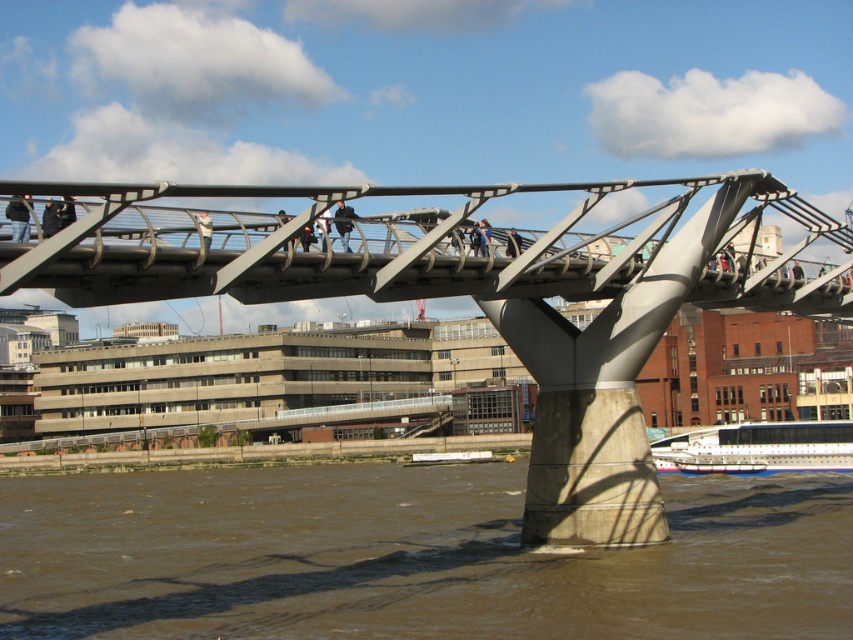
You are standing on the Millennium Bridge and notice the brown muddy water at lower center and the black matte pedestrian at center. From your perspective, which object is closer to you?

The brown muddy water at lower center is closer to you because it is in front of the black matte pedestrian at center.

You are standing on the polished steel bridge at center and want to take a photo of the dark blue jeans at left. Which direction should you face to capture both the bridge and the jeans in the frame?

The polished steel bridge at center is to the left of dark blue jeans at left, so you should face to the right to include both the bridge and the jeans in the photo.

You are a photographer planning to capture a shot of the Millennium Bridge. You notice the brown muddy water at lower center and the black matte pedestrian at center. Based on their widths, which one would you focus on to ensure the subject fills the frame adequately?

The brown muddy water at lower center has a greater width than the black matte pedestrian at center, so focusing on the brown muddy water at lower center would better fill the frame.